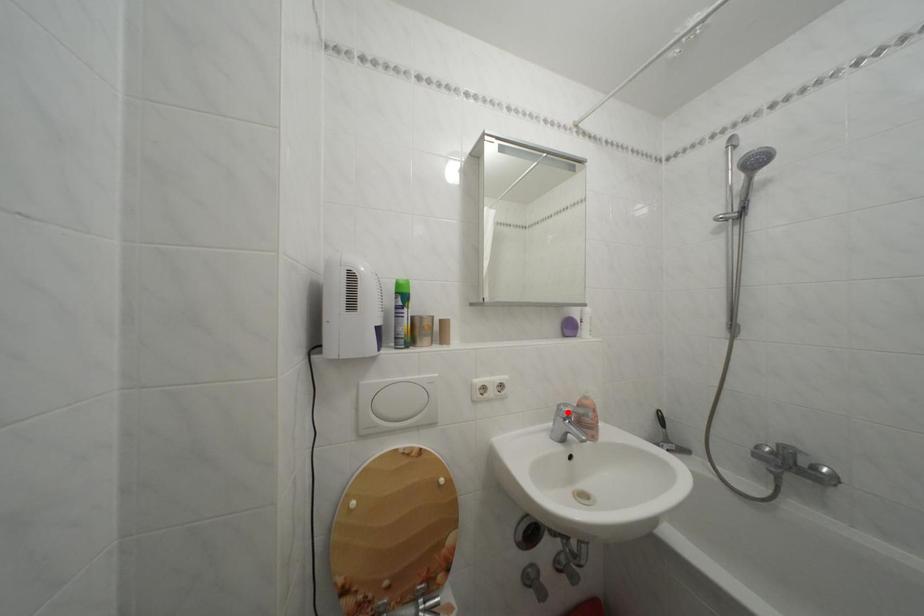
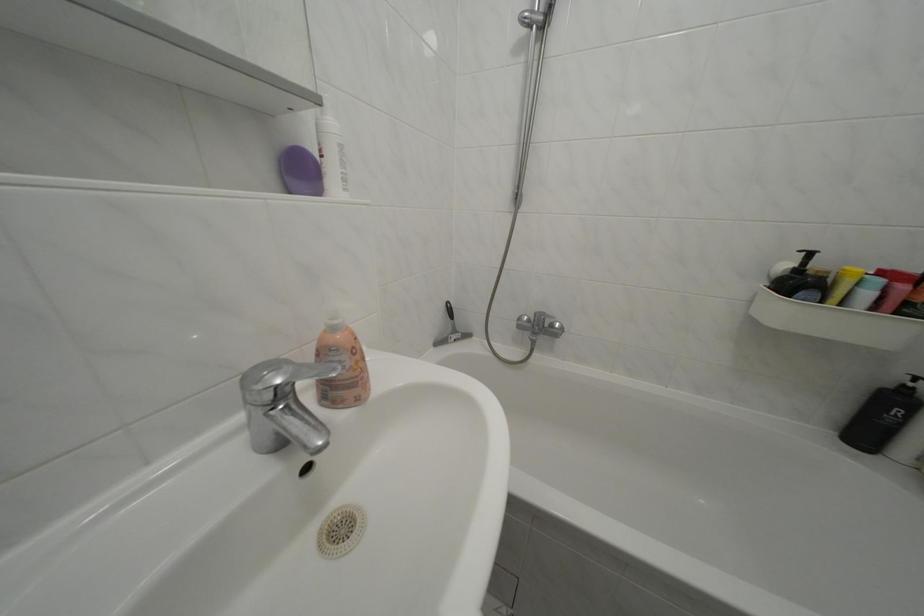
The point at the highlighted location is marked in the first image. Where is the corresponding point in the second image?

(252, 384)